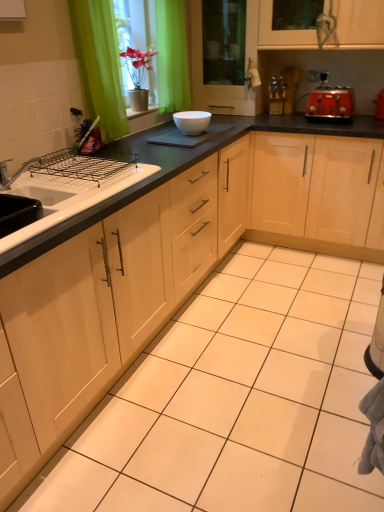
Question: Should I look upward or downward to see red matte toaster at upper right?

Choices:
 (A) up
 (B) down

Answer: (A)

Question: Which direction should I rotate to look at matte wood cabinet at center, the 1th cabinetry viewed from the left, — up or down?

Choices:
 (A) down
 (B) up

Answer: (B)

Question: Is transparent glass screen door at upper center shorter than red matte toaster at upper right?

Choices:
 (A) yes
 (B) no

Answer: (B)

Question: Can you confirm if transparent glass screen door at upper center is taller than red matte toaster at upper right?

Choices:
 (A) yes
 (B) no

Answer: (A)

Question: Could red matte toaster at upper right be considered to be inside transparent glass screen door at upper center?

Choices:
 (A) yes
 (B) no

Answer: (B)

Question: Could you tell me if transparent glass screen door at upper center is facing red matte toaster at upper right?

Choices:
 (A) no
 (B) yes

Answer: (A)

Question: Would you consider transparent glass screen door at upper center to be distant from red matte toaster at upper right?

Choices:
 (A) no
 (B) yes

Answer: (A)

Question: Considering the relative sizes of transparent glass screen door at upper center and red matte toaster at upper right in the image provided, is transparent glass screen door at upper center smaller than red matte toaster at upper right?

Choices:
 (A) yes
 (B) no

Answer: (B)

Question: From a real-world perspective, is red matte toaster at upper right located higher than white glossy bowl at center?

Choices:
 (A) yes
 (B) no

Answer: (A)

Question: Is red matte toaster at upper right to the right of white glossy bowl at center from the viewer's perspective?

Choices:
 (A) yes
 (B) no

Answer: (A)

Question: Is red matte toaster at upper right closer to the viewer compared to white glossy bowl at center?

Choices:
 (A) no
 (B) yes

Answer: (A)

Question: From the image's perspective, would you say red matte toaster at upper right is shown under white glossy bowl at center?

Choices:
 (A) no
 (B) yes

Answer: (A)

Question: Is the position of red matte toaster at upper right more distant than that of white glossy bowl at center?

Choices:
 (A) yes
 (B) no

Answer: (A)

Question: From the image's perspective, would you say red matte toaster at upper right is positioned over white glossy bowl at center?

Choices:
 (A) yes
 (B) no

Answer: (A)

Question: From the image's perspective, is white glossy bowl at center located beneath light wood cabinet at center, which appears as the second cabinetry when viewed from the left?

Choices:
 (A) no
 (B) yes

Answer: (A)